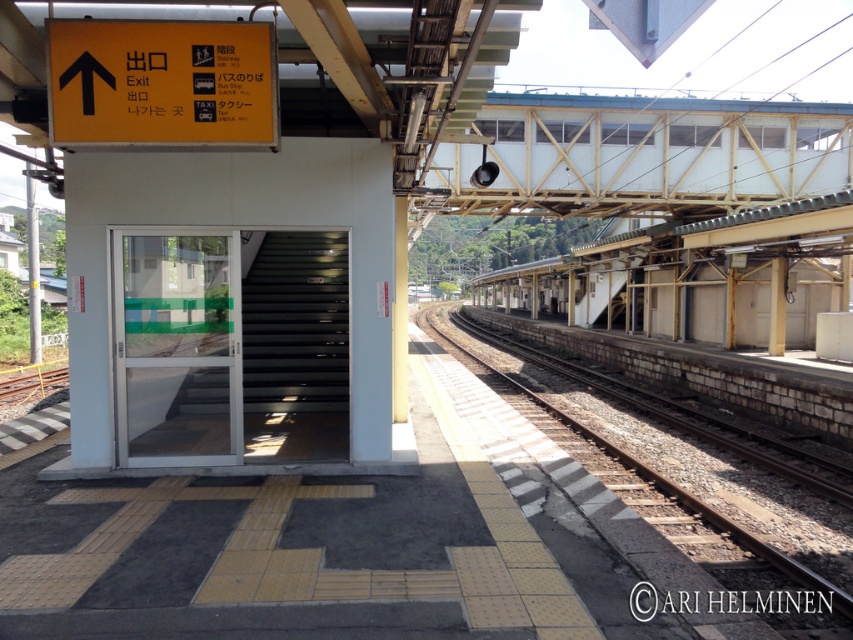
Does white painted steel bridge at upper right have a greater height compared to brown gravel track at center?

Yes, white painted steel bridge at upper right is taller than brown gravel track at center.

Which is above, white painted steel bridge at upper right or brown gravel track at center?

white painted steel bridge at upper right is higher up.

Is point (751, 125) behind point (558, 432)?

Yes.

Locate an element on the screen. This screenshot has width=853, height=640. white painted steel bridge at upper right is located at coordinates pyautogui.click(x=643, y=154).

You are a GUI agent. You are given a task and a screenshot of the screen. Output one action in this format:
    pyautogui.click(x=<x>, y=<y>)
    Task: Click on the white painted steel bridge at upper right
    This screenshot has width=853, height=640.
    Given the screenshot: What is the action you would take?
    pyautogui.click(x=643, y=154)

Between point (621, 102) and point (223, 83), which one is positioned in front?

Point (223, 83)

Is point (712, 104) closer to camera compared to point (125, 140)?

No, (712, 104) is behind (125, 140).

Find the location of a particular element. white painted steel bridge at upper right is located at coordinates (643, 154).

In the scene shown: Who is shorter, yellow plastic sign at upper left or brown gravel track at center?

With less height is yellow plastic sign at upper left.

Does point (67, 22) come behind point (639, 481)?

No, it is not.

Between point (59, 140) and point (772, 620), which one is positioned in front?

Positioned in front is point (59, 140).

The image size is (853, 640). I want to click on yellow plastic sign at upper left, so click(161, 83).